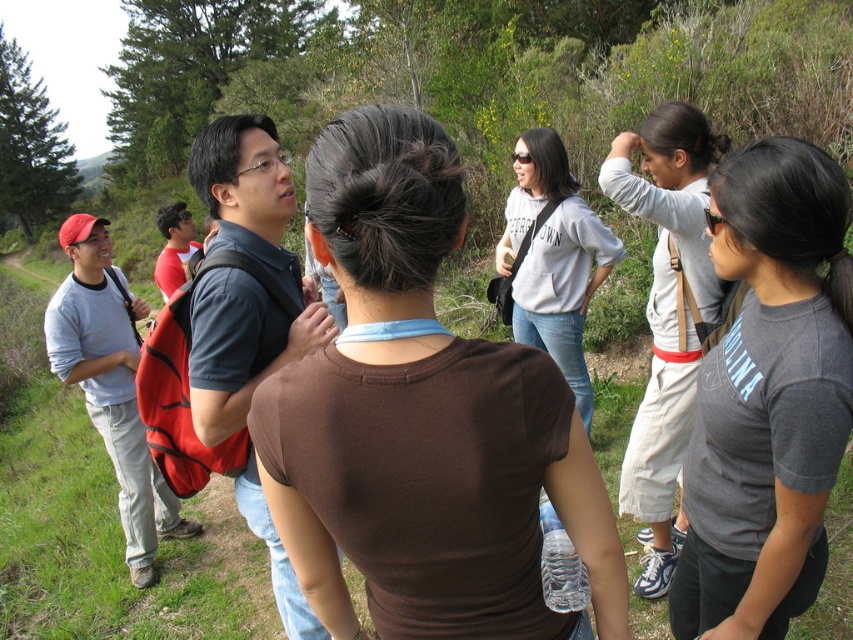
Question: Among these points, which one is farthest from the camera?

Choices:
 (A) (598, 225)
 (B) (688, 323)

Answer: (A)

Question: Is gray cotton t-shirt at upper right above gray cotton sweatshirt at center?

Choices:
 (A) no
 (B) yes

Answer: (A)

Question: Which of these objects is positioned farthest from the gray cotton t-shirt at upper right?

Choices:
 (A) gray cotton sweatshirt at center
 (B) light gray cotton shirt at upper right

Answer: (A)

Question: Is gray cotton t-shirt at upper right below gray cotton sweatshirt at center?

Choices:
 (A) no
 (B) yes

Answer: (B)

Question: Which object is the farthest from the light gray cotton shirt at upper right?

Choices:
 (A) gray cotton t-shirt at upper right
 (B) brown cotton shirt at center

Answer: (B)

Question: Does brown cotton shirt at center appear on the right side of light gray cotton shirt at upper right?

Choices:
 (A) no
 (B) yes

Answer: (A)